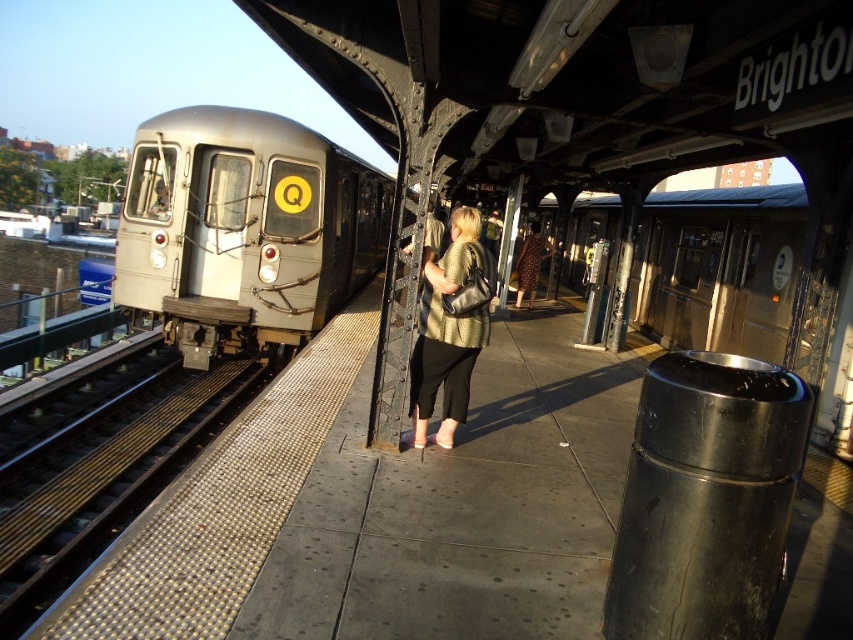
From the picture: You are a passenger waiting at the Brighton subway station. You notice two metallic items in your view. One is a metallic gold blouse at center and the other is a metallic gray train at left. Which metallic object appears bigger to you?

The metallic gold blouse at center appears larger than the metallic gray train at left.